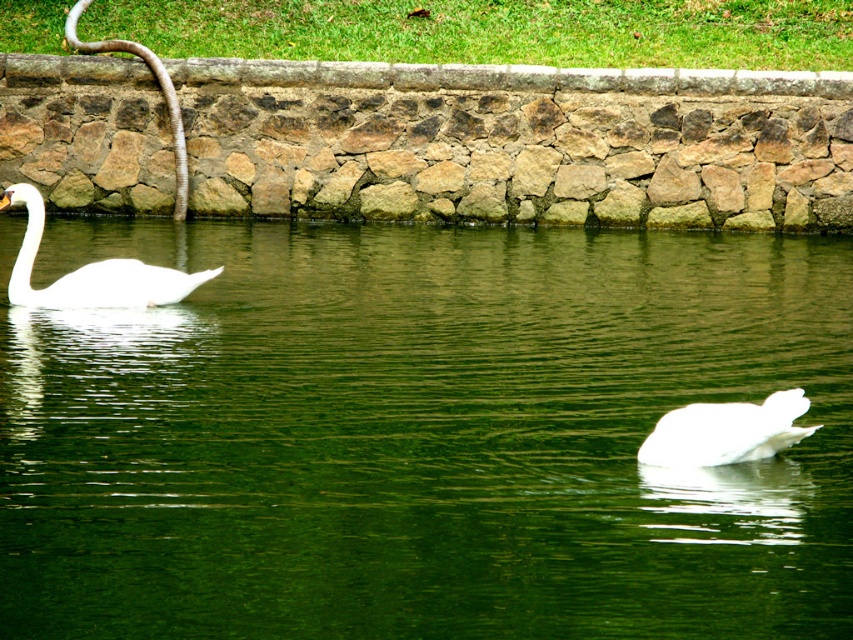
Question: Does green smooth water at center appear over white glossy swan at left?

Choices:
 (A) yes
 (B) no

Answer: (B)

Question: Among these objects, which one is farthest from the camera?

Choices:
 (A) white matte swan at lower right
 (B) green smooth water at center

Answer: (A)

Question: In this image, where is white matte swan at lower right located relative to white glossy swan at left?

Choices:
 (A) right
 (B) left

Answer: (A)

Question: Is green smooth water at center thinner than white matte swan at lower right?

Choices:
 (A) no
 (B) yes

Answer: (A)

Question: Which is nearer to the white glossy swan at left?

Choices:
 (A) white matte swan at lower right
 (B) green smooth water at center

Answer: (B)

Question: Which point is closer to the camera taking this photo?

Choices:
 (A) (183, 273)
 (B) (595, 282)

Answer: (B)